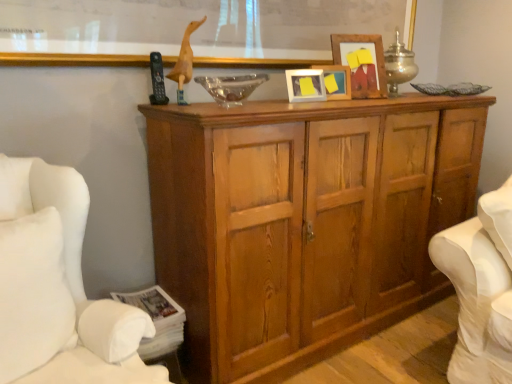
Question: From a real-world perspective, is transparent glass bowl at center above or below metallic silver table lamp at upper center?

Choices:
 (A) above
 (B) below

Answer: (B)

Question: Is transparent glass bowl at center inside or outside of metallic silver table lamp at upper center?

Choices:
 (A) outside
 (B) inside

Answer: (A)

Question: Estimate the real-world distances between objects in this image. Which object is closer to the wooden cupboard at center?

Choices:
 (A) matte wooden picture frame at center, arranged as the third picture frame when viewed from the right
 (B) white fabric swivel chair at right
 (C) wooden cabinet at left
 (D) wooden frame at upper center
 (E) wooden picture frame at center, the second picture frame viewed from the right

Answer: (B)

Question: Which object is positioned farthest from the transparent glass bowl at center?

Choices:
 (A) metallic silver table lamp at upper center
 (B) wooden picture frame at center, which is the second picture frame from left to right
 (C) wooden cupboard at center
 (D) wooden cabinet at left
 (E) wooden frame at upper center

Answer: (A)